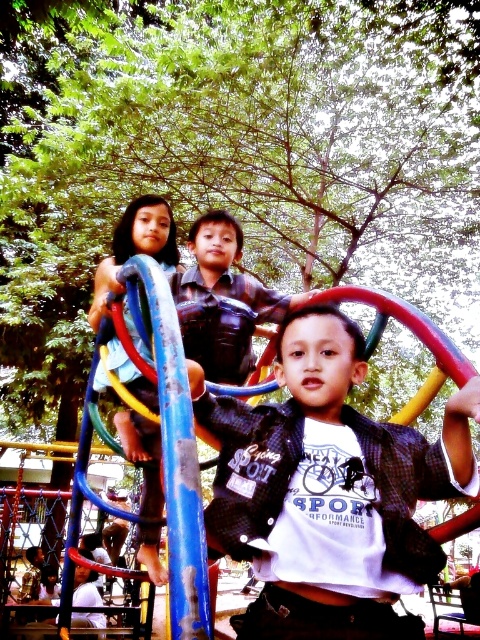
You are standing at the origin point of the playground coordinate system. You need to locate the matte blue pole at center. What are its coordinates?

The coordinates of the matte blue pole at center are at point (222, 298).

You are a parent trying to decide which play area to let your child use. The playground has two options available. One has a matte blue pole at center, and the other has a light blue fabric at left. Based on their heights, which one would you consider safer for younger children?

The matte blue pole at center is not as tall as the light blue fabric at left, so the area with the shorter matte blue pole at center may be safer for younger children.

You are a photographer trying to capture a photo of the matte black shirt at center and the light blue fabric at left. Which object is closer to the camera?

The matte black shirt at center is positioned under the light blue fabric at left, so it is closer to the camera than the light blue fabric at left.